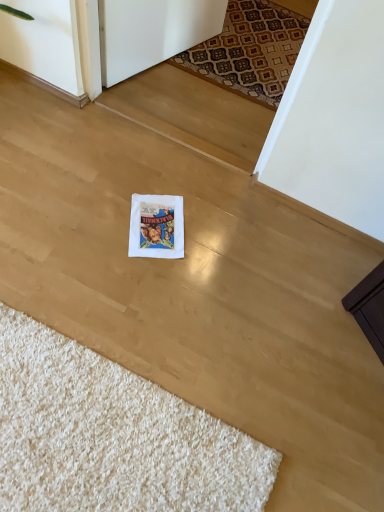
Where is `vacant area that is situated to the right of white paper postcard at center`? Image resolution: width=384 pixels, height=512 pixels. vacant area that is situated to the right of white paper postcard at center is located at coordinates (217, 240).